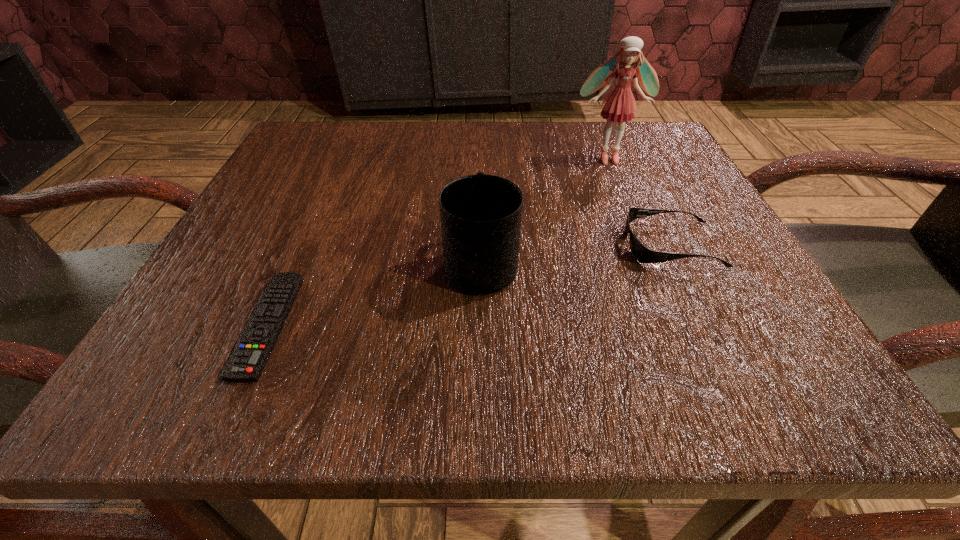
Where is `free space between the shortest object and the mug`? free space between the shortest object and the mug is located at coordinates (374, 294).

Find the location of a particular element. The width and height of the screenshot is (960, 540). free space between the farthest object and the remote control is located at coordinates (438, 241).

I want to click on vacant space that's between the mug and the tallest object, so click(x=544, y=211).

Find the location of a particular element. This screenshot has height=540, width=960. vacant space in between the shortest object and the third object from right to left is located at coordinates (374, 294).

The height and width of the screenshot is (540, 960). Identify the location of vacant area that lies between the second tallest object and the sunglasses. (576, 254).

Find the location of a particular element. free spot between the remote control and the farthest object is located at coordinates (438, 241).

At what (x,y) coordinates should I click in order to perform the action: click on vacant area between the second object from left to right and the remote control. Please return your answer as a coordinate pair (x, y). The height and width of the screenshot is (540, 960). Looking at the image, I should click on (374, 294).

This screenshot has width=960, height=540. In order to click on vacant space that's between the leftmost object and the second object from left to right in this screenshot , I will do `click(374, 294)`.

You are a GUI agent. You are given a task and a screenshot of the screen. Output one action in this format:
    pyautogui.click(x=<x>, y=<y>)
    Task: Click on the free space between the doll and the second shortest object
    This screenshot has width=960, height=540.
    Given the screenshot: What is the action you would take?
    pyautogui.click(x=639, y=201)

Choose which object is the second nearest neighbor to the tallest object. Please provide its 2D coordinates. Your answer should be formatted as a tuple, i.e. [(x, y)], where the tuple contains the x and y coordinates of a point satisfying the conditions above.

[(480, 214)]